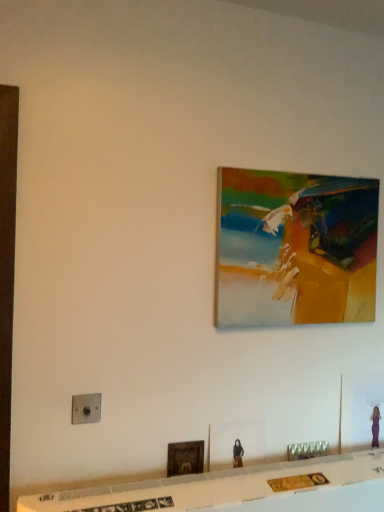
Question: Is oil painting at upper center, which is the 1th picture frame from right to left, at the back of metallic gold decorative piece at lower center?

Choices:
 (A) no
 (B) yes

Answer: (A)

Question: From a real-world perspective, is metallic gold decorative piece at lower center positioned under oil painting at upper center, the 1th picture frame from the back, based on gravity?

Choices:
 (A) yes
 (B) no

Answer: (A)

Question: Does metallic gold decorative piece at lower center have a smaller size compared to oil painting at upper center, which ranks as the second picture frame in left-to-right order?

Choices:
 (A) yes
 (B) no

Answer: (A)

Question: Can you confirm if metallic gold decorative piece at lower center is wider than oil painting at upper center, the second picture frame ordered from the bottom?

Choices:
 (A) yes
 (B) no

Answer: (B)

Question: Does metallic gold decorative piece at lower center have a larger size compared to oil painting at upper center, the 1th picture frame from the back?

Choices:
 (A) no
 (B) yes

Answer: (A)

Question: Considering their positions, is metallic gold decorative piece at lower center located in front of or behind metallic gold picture frame at lower center, which ranks as the 1th picture frame in bottom-to-top order?

Choices:
 (A) behind
 (B) front

Answer: (A)

Question: Considering the relative positions of metallic gold decorative piece at lower center and metallic gold picture frame at lower center, the 2th picture frame viewed from the top, in the image provided, is metallic gold decorative piece at lower center to the left or to the right of metallic gold picture frame at lower center, the 2th picture frame viewed from the top,?

Choices:
 (A) right
 (B) left

Answer: (A)

Question: Does point (322, 440) appear closer or farther from the camera than point (175, 448)?

Choices:
 (A) closer
 (B) farther

Answer: (B)

Question: Is metallic gold decorative piece at lower center inside or outside of metallic gold picture frame at lower center, arranged as the 1th picture frame when viewed from the left?

Choices:
 (A) inside
 (B) outside

Answer: (B)

Question: From a real-world perspective, relative to satin silver switch at lower left, is oil painting at upper center, which ranks as the second picture frame in left-to-right order, vertically above or below?

Choices:
 (A) below
 (B) above

Answer: (B)

Question: Which is correct: oil painting at upper center, the 1th picture frame from the back, is inside satin silver switch at lower left, or outside of it?

Choices:
 (A) inside
 (B) outside

Answer: (B)

Question: From the image's perspective, is oil painting at upper center, which ranks as the second picture frame in left-to-right order, positioned above or below satin silver switch at lower left?

Choices:
 (A) below
 (B) above

Answer: (B)

Question: Does point (225, 221) appear closer or farther from the camera than point (94, 394)?

Choices:
 (A) closer
 (B) farther

Answer: (B)

Question: From a real-world perspective, relative to satin silver switch at lower left, is metallic gold picture frame at lower center, acting as the first picture frame starting from the front, vertically above or below?

Choices:
 (A) above
 (B) below

Answer: (B)

Question: Based on their positions, is metallic gold picture frame at lower center, acting as the first picture frame starting from the front, located to the left or right of satin silver switch at lower left?

Choices:
 (A) left
 (B) right

Answer: (B)